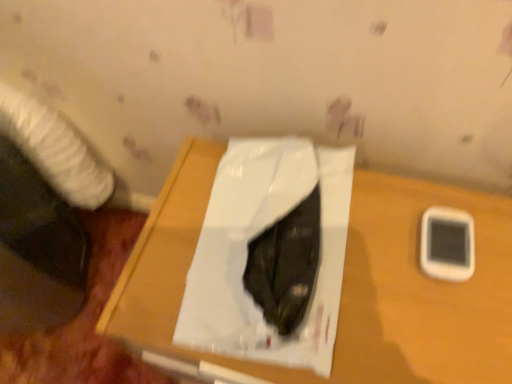
Locate an element on the screen. This screenshot has height=384, width=512. free spot behind white plastic mobile phone at right is located at coordinates tap(402, 196).